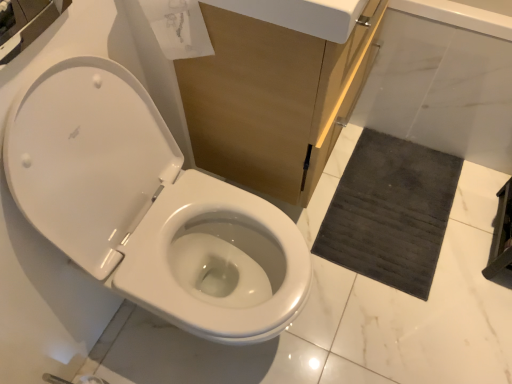
Find the location of a particular element. The image size is (512, 384). vacant space in front of white marble bath at lower right is located at coordinates (434, 216).